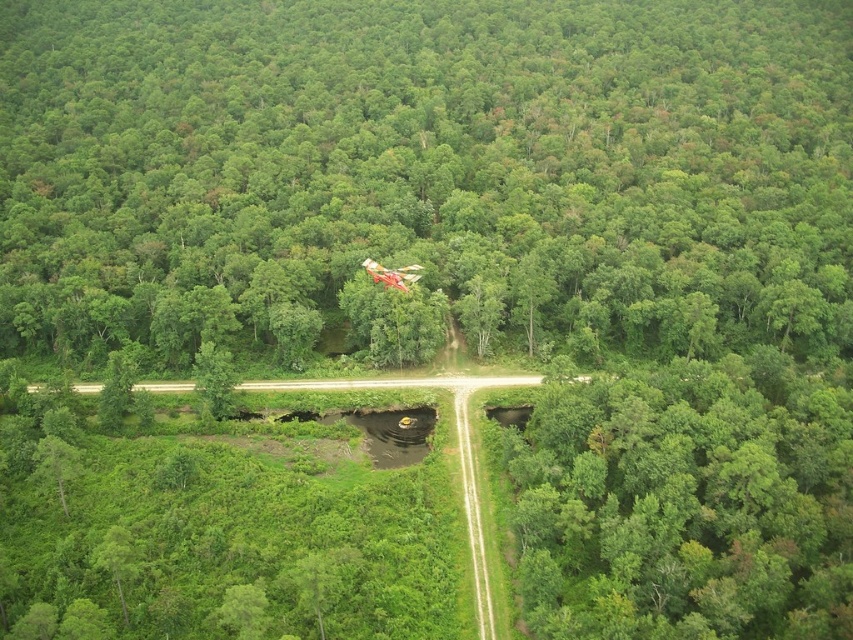
Question: In this image, where is green leafy tree at lower right located relative to metallic red helicopter at center?

Choices:
 (A) above
 (B) below

Answer: (B)

Question: In this image, where is green leafy tree at lower right located relative to metallic red helicopter at center?

Choices:
 (A) left
 (B) right

Answer: (B)

Question: Among these objects, which one is farthest from the camera?

Choices:
 (A) metallic red helicopter at center
 (B) green leafy tree at lower right

Answer: (A)

Question: Can you confirm if green leafy tree at lower right is thinner than metallic red helicopter at center?

Choices:
 (A) yes
 (B) no

Answer: (B)

Question: Which point is farther to the camera?

Choices:
 (A) (804, 484)
 (B) (392, 269)

Answer: (B)